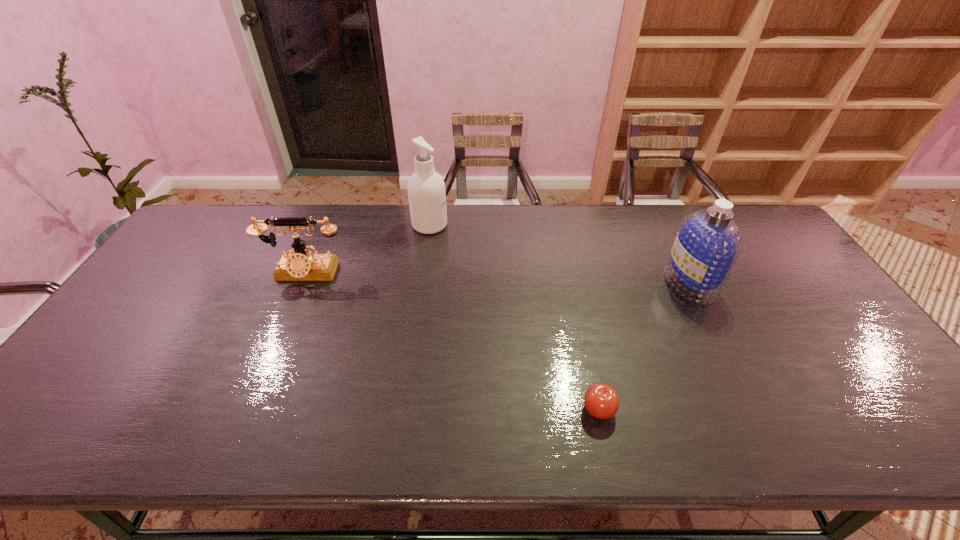
Image resolution: width=960 pixels, height=540 pixels. In order to click on vacant area that satisfies the following two spatial constraints: 1. on the back side of the apple; 2. on the front label of the second object from left to right in this screenshot , I will do `click(559, 225)`.

The image size is (960, 540). Identify the location of free spot that satisfies the following two spatial constraints: 1. on the front label of the left cleansing agent; 2. on the dial of the telephone. (423, 273).

Locate an element on the screen. vacant space that satisfies the following two spatial constraints: 1. on the dial of the second object from right to left; 2. on the right side of the third tallest object is located at coordinates (247, 409).